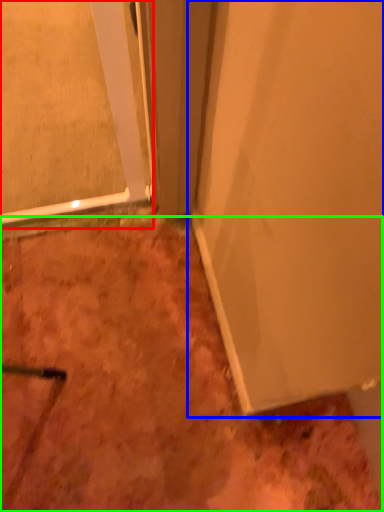
Question: Based on their relative distances, which object is farther from glass door (highlighted by a red box)? Choose from door (highlighted by a blue box) and dirt (highlighted by a green box).

Choices:
 (A) door
 (B) dirt

Answer: (B)